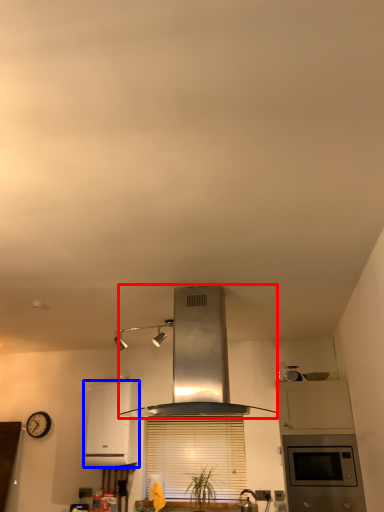
Question: Which point is closer to the camera, home appliance (highlighted by a red box) or home appliance (highlighted by a blue box)?

Choices:
 (A) home appliance
 (B) home appliance

Answer: (A)